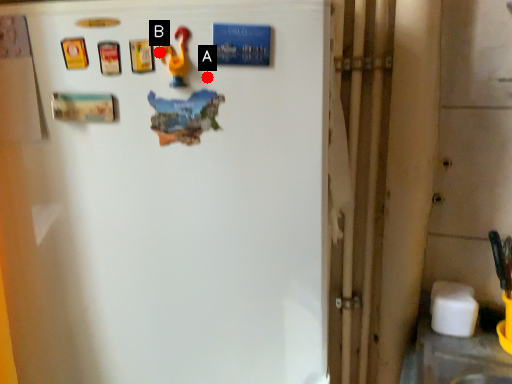
Question: Two points are circled on the image, labeled by A and B beside each circle. Which of the following is the closest to the observer?

Choices:
 (A) A is closer
 (B) B is closer

Answer: (B)